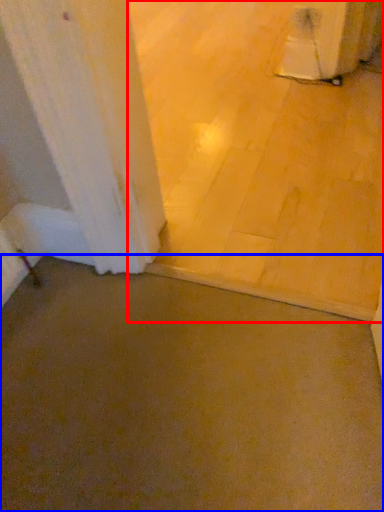
Question: Which point is further to the camera, concrete (highlighted by a red box) or concrete (highlighted by a blue box)?

Choices:
 (A) concrete
 (B) concrete

Answer: (A)